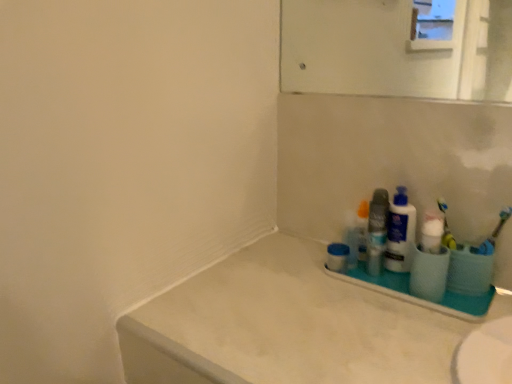
Measure the distance between white plastic cup at right, the 2th cleaning product in the back-to-front sequence, and camera.

white plastic cup at right, the 2th cleaning product in the back-to-front sequence, and camera are 35.03 inches apart.

This screenshot has width=512, height=384. Describe the element at coordinates (337, 257) in the screenshot. I see `blue matte jar at right` at that location.

The width and height of the screenshot is (512, 384). Describe the element at coordinates (418, 297) in the screenshot. I see `white plastic tray at lower right` at that location.

Find the location of a particular element. Image resolution: width=512 pixels, height=384 pixels. blue rubber toothbrush at right, the first toothbrush positioned from the right is located at coordinates (494, 234).

Which is in front, white plastic bottle at right, which is counted as the first cleaning product, starting from the back, or blue matte jar at right?

white plastic bottle at right, which is counted as the first cleaning product, starting from the back, is closer to the camera.

From a real-world perspective, is white plastic bottle at right, which is the 2th cleaning product in front-to-back order, above or below blue matte jar at right?

white plastic bottle at right, which is the 2th cleaning product in front-to-back order, is above blue matte jar at right.

Measure the distance between white plastic bottle at right, which is counted as the first cleaning product, starting from the back, and blue matte jar at right.

The distance of white plastic bottle at right, which is counted as the first cleaning product, starting from the back, from blue matte jar at right is 5.10 inches.

Which is closer, (331, 273) or (348, 251)?

Positioned in front is point (331, 273).

Does white plastic tray at lower right have a smaller size compared to blue matte jar at right?

No, white plastic tray at lower right is not smaller than blue matte jar at right.

Which object is wider, white plastic tray at lower right or blue matte jar at right?

Wider between the two is white plastic tray at lower right.

Is white plastic tray at lower right turned away from blue matte jar at right?

No.

Does point (343, 246) come closer to viewer compared to point (443, 232)?

No, (343, 246) is behind (443, 232).

How different are the orientations of blue matte jar at right and white plastic cup at right, which appears as the 1th cleaning product when viewed from the front, in degrees?

The facing directions of blue matte jar at right and white plastic cup at right, which appears as the 1th cleaning product when viewed from the front, are 0.000828 degrees apart.

Is blue matte jar at right beside white plastic cup at right, which appears as the 1th cleaning product when viewed from the front?

blue matte jar at right is not next to white plastic cup at right, which appears as the 1th cleaning product when viewed from the front, and they're not touching.

Image resolution: width=512 pixels, height=384 pixels. Find the location of `the 1st toothbrush above when counting from the white plastic bottle at right, which is counted as the first cleaning product, starting from the back (from the image's perspective)`. the 1st toothbrush above when counting from the white plastic bottle at right, which is counted as the first cleaning product, starting from the back (from the image's perspective) is located at coordinates (494, 234).

Does blue rubber toothbrush at right, which is the second toothbrush from left to right, have a lesser height compared to white plastic bottle at right, which is the 2th cleaning product in front-to-back order?

Yes, blue rubber toothbrush at right, which is the second toothbrush from left to right, is shorter than white plastic bottle at right, which is the 2th cleaning product in front-to-back order.

Is blue rubber toothbrush at right, which is the second toothbrush from left to right, far from white plastic bottle at right, which is counted as the first cleaning product, starting from the back?

No.

From a real-world perspective, is blue rubber toothbrush at right, the first toothbrush positioned from the right, located higher than white plastic bottle at right, which is the 2th cleaning product in front-to-back order?

Indeed, from a real-world perspective, blue rubber toothbrush at right, the first toothbrush positioned from the right, stands above white plastic bottle at right, which is the 2th cleaning product in front-to-back order.

Identify the location of cleaning product above the translucent plastic bottles at right (from a real-world perspective). (432, 232).

From the image's perspective, who appears lower, translucent plastic bottles at right or white plastic cup at right, which appears as the 1th cleaning product when viewed from the front?

translucent plastic bottles at right.

In the scene shown: From a real-world perspective, between translucent plastic bottles at right and white plastic cup at right, the 2th cleaning product in the back-to-front sequence, who is vertically lower?

translucent plastic bottles at right.

Between blue rubber toothbrush at right, which is the second toothbrush from left to right, and white plastic cup at right, the 2th cleaning product in the back-to-front sequence, which one has smaller width?

With smaller width is blue rubber toothbrush at right, which is the second toothbrush from left to right.

Does blue rubber toothbrush at right, the first toothbrush positioned from the right, have a larger size compared to white plastic cup at right, the 2th cleaning product in the back-to-front sequence?

No, blue rubber toothbrush at right, the first toothbrush positioned from the right, is not bigger than white plastic cup at right, the 2th cleaning product in the back-to-front sequence.

Are blue rubber toothbrush at right, which is the second toothbrush from left to right, and white plastic cup at right, the 2th cleaning product in the back-to-front sequence, far apart?

blue rubber toothbrush at right, which is the second toothbrush from left to right, is near white plastic cup at right, the 2th cleaning product in the back-to-front sequence, not far away.

From the image's perspective, is blue rubber toothbrush at right, which is the second toothbrush from left to right, over white plastic cup at right, which appears as the 1th cleaning product when viewed from the front?

Correct, blue rubber toothbrush at right, which is the second toothbrush from left to right, appears higher than white plastic cup at right, which appears as the 1th cleaning product when viewed from the front, in the image.

Consider the image. From the image's perspective, between yellow plastic toothbrush at right, the 2th toothbrush in the right-to-left sequence, and white plastic cup at right, which appears as the 1th cleaning product when viewed from the front, who is located below?

From the image's view, white plastic cup at right, which appears as the 1th cleaning product when viewed from the front, is below.

Does yellow plastic toothbrush at right, the 2th toothbrush in the right-to-left sequence, have a larger size compared to white plastic cup at right, the 2th cleaning product in the back-to-front sequence?

No, yellow plastic toothbrush at right, the 2th toothbrush in the right-to-left sequence, is not bigger than white plastic cup at right, the 2th cleaning product in the back-to-front sequence.

Are yellow plastic toothbrush at right, the 2th toothbrush in the right-to-left sequence, and white plastic cup at right, the 2th cleaning product in the back-to-front sequence, located far from each other?

No, there isn't a large distance between yellow plastic toothbrush at right, the 2th toothbrush in the right-to-left sequence, and white plastic cup at right, the 2th cleaning product in the back-to-front sequence.

Could you tell me if yellow plastic toothbrush at right, which is counted as the first toothbrush, starting from the left, is facing white plastic cup at right, which appears as the 1th cleaning product when viewed from the front?

Yes, yellow plastic toothbrush at right, which is counted as the first toothbrush, starting from the left, faces towards white plastic cup at right, which appears as the 1th cleaning product when viewed from the front.

Locate an element on the screen. Image resolution: width=512 pixels, height=384 pixels. the 1st cleaning product in front of the blue matte jar at right is located at coordinates (400, 233).

Identify the location of window sill to the right of blue matte jar at right. The image size is (512, 384). (418, 297).

Considering their positions, is translucent plastic bottles at right positioned closer to white plastic tray at lower right than blue matte jar at right?

Based on the image, translucent plastic bottles at right appears to be nearer to white plastic tray at lower right.

Which object lies further to the anchor point white plastic cup at right, which appears as the 1th cleaning product when viewed from the front, translucent plastic bottles at right or blue matte jar at right?

Among the two, blue matte jar at right is located further to white plastic cup at right, which appears as the 1th cleaning product when viewed from the front.

Based on their spatial positions, is translucent plastic bottles at right or yellow plastic toothbrush at right, which is counted as the first toothbrush, starting from the left, closer to white matte counter top at lower right?

translucent plastic bottles at right lies closer to white matte counter top at lower right than the other object.

Looking at the image, which one is located further to white plastic tray at lower right, white plastic cup at right, which appears as the 1th cleaning product when viewed from the front, or white plastic bottle at right, which is the 2th cleaning product in front-to-back order?

white plastic cup at right, which appears as the 1th cleaning product when viewed from the front, lies further to white plastic tray at lower right than the other object.

Estimate the real-world distances between objects in this image. Which object is closer to white plastic bottle at right, which is counted as the first cleaning product, starting from the back, white plastic cup at right, which appears as the 1th cleaning product when viewed from the front, or white plastic tray at lower right?

The object closer to white plastic bottle at right, which is counted as the first cleaning product, starting from the back, is white plastic cup at right, which appears as the 1th cleaning product when viewed from the front.

Estimate the real-world distances between objects in this image. Which object is further from translucent plastic bottles at right, white plastic tray at lower right or blue rubber toothbrush at right, the first toothbrush positioned from the right?

Among the two, blue rubber toothbrush at right, the first toothbrush positioned from the right, is located further to translucent plastic bottles at right.

Estimate the real-world distances between objects in this image. Which object is closer to white plastic tray at lower right, blue matte jar at right or white matte counter top at lower right?

blue matte jar at right lies closer to white plastic tray at lower right than the other object.

From the picture: Based on their spatial positions, is blue matte jar at right or white plastic tray at lower right closer to white plastic cup at right, the 2th cleaning product in the back-to-front sequence?

The object closer to white plastic cup at right, the 2th cleaning product in the back-to-front sequence, is white plastic tray at lower right.

I want to click on cleaning product between white plastic cup at right, the 2th cleaning product in the back-to-front sequence, and white plastic tray at lower right vertically, so click(400, 233).

Identify the location of toothbrush situated between blue matte jar at right and blue rubber toothbrush at right, the first toothbrush positioned from the right, from left to right. (446, 227).

Image resolution: width=512 pixels, height=384 pixels. Identify the location of toiletry that lies between yellow plastic toothbrush at right, which is counted as the first toothbrush, starting from the left, and white plastic tray at lower right from top to bottom. (377, 231).

This screenshot has width=512, height=384. What are the coordinates of `window sill situated between translucent plastic bottles at right and blue rubber toothbrush at right, which is the second toothbrush from left to right, from left to right` in the screenshot? It's located at (418, 297).